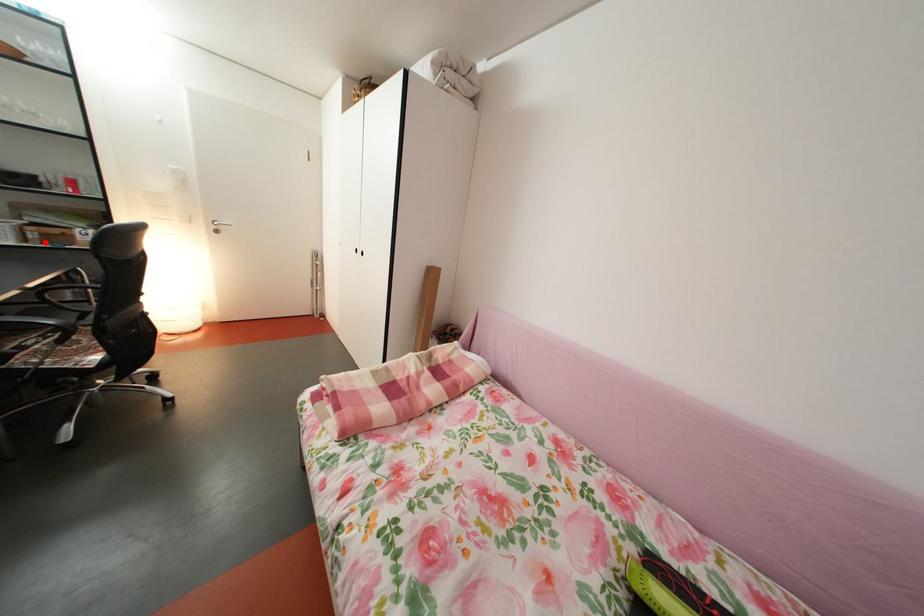
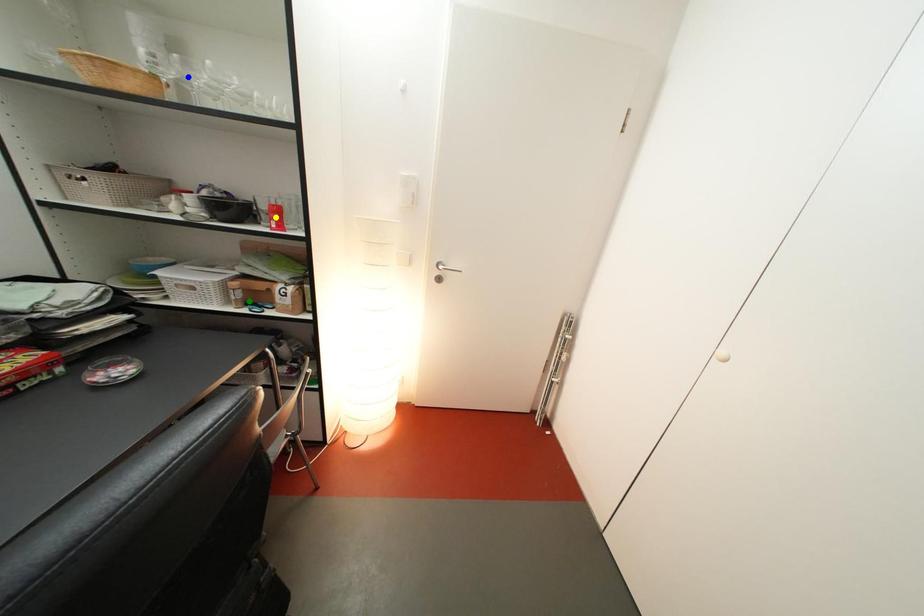
Question: I am providing you with two images of the same scene from different viewpoints. A red point is marked on the first image. You are given multiple points on the second image. In image 2, which mark is for the same physical point as the one in image 1?

Choices:
 (A) green point
 (B) blue point
 (C) yellow point

Answer: (A)